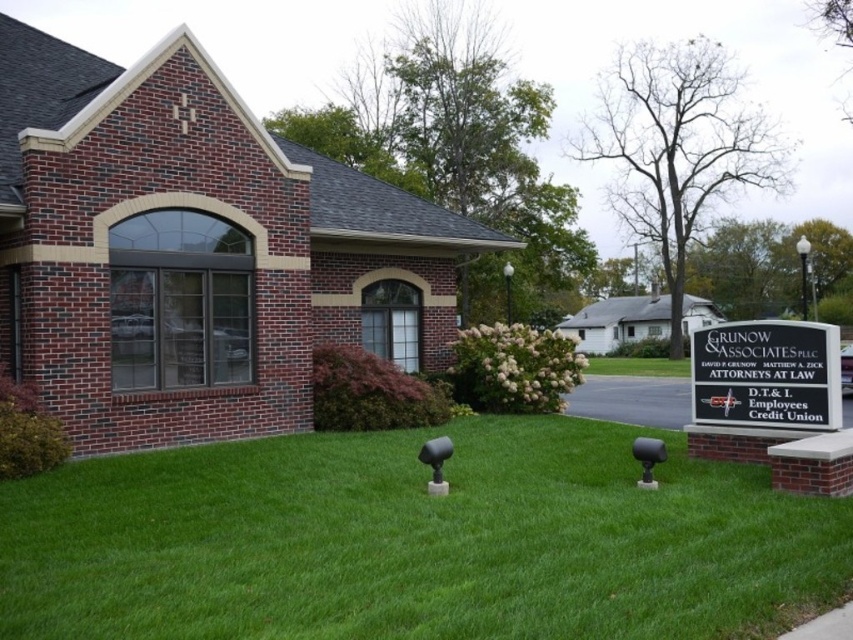
You are standing at the entrance of the brick building and want to locate two points marked on the lawn. The first point is at coordinate point (717, 525) and the second is at point (782, 420). Which of these two points is closer to the building?

Point (782, 420) is closer to the building because it is behind point (717, 525), which is in front of it.

You are standing at the entrance of the brick building and want to check if you can walk from the entrance to the green grass at center without getting wet. The sprinkler system is currently off. Can you walk there safely?

Yes, you can walk safely to the green grass at center as the distance is 4.29 meters and the sprinkler system is off.

You are standing at the entrance of the brick building and want to walk to the green grass at center. What direction should you walk in?

You should walk forward towards the green grass at center located at point (416, 543).